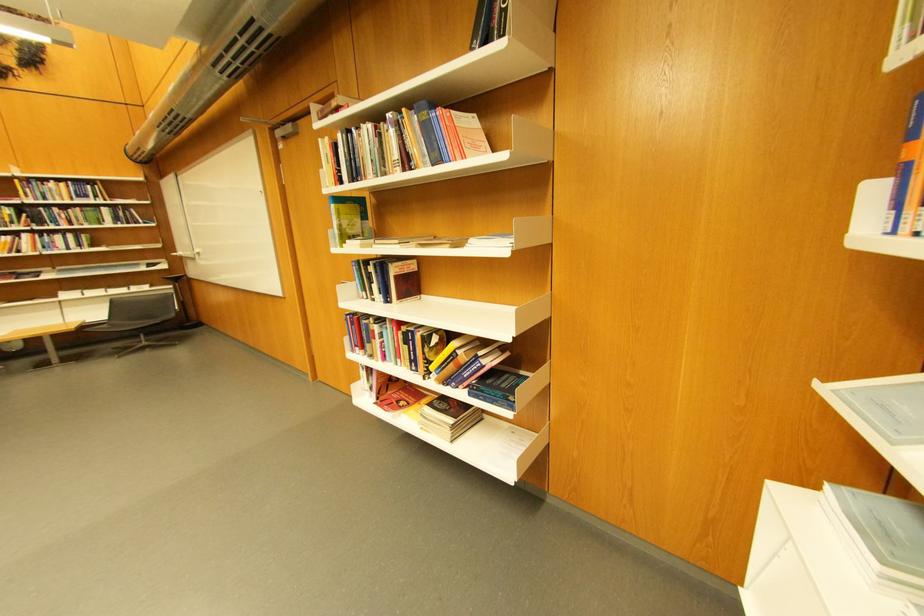
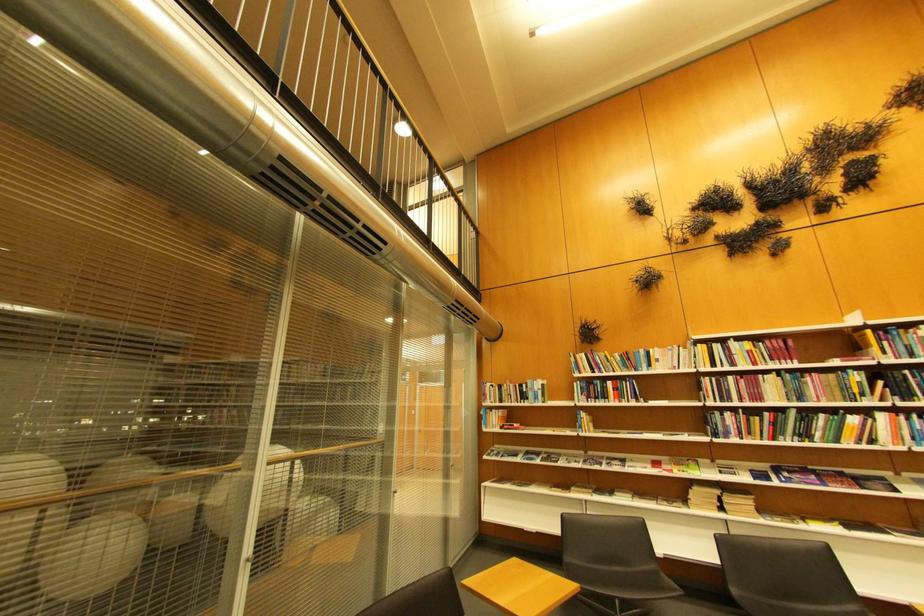
Locate, in the second image, the point that corresponds to (x=27, y=182) in the first image.

(880, 333)